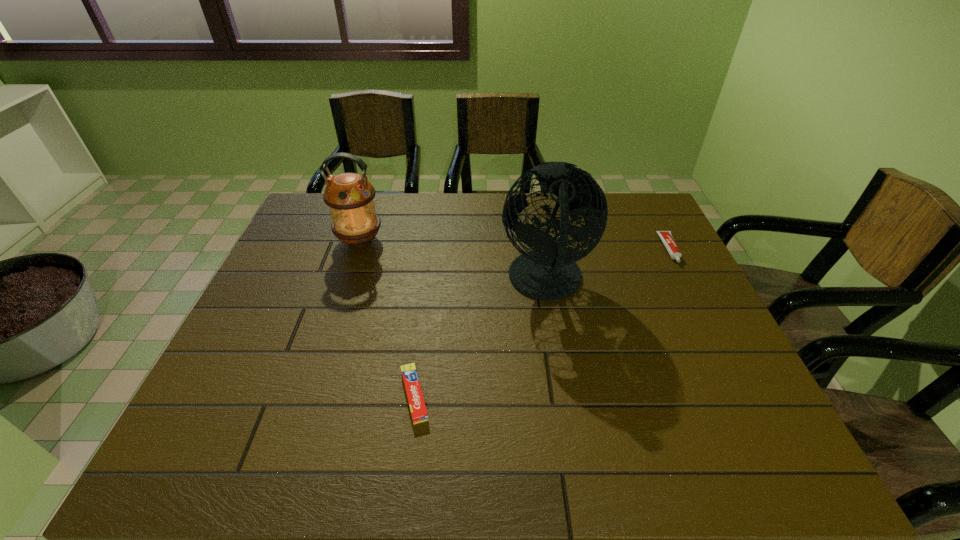
What are the coordinates of `free space between the tallest object and the oil lamp` in the screenshot? It's located at (453, 261).

Locate an element on the screen. empty space that is in between the shorter toothpaste and the third shortest object is located at coordinates (387, 318).

Locate an element on the screen. free space between the right toothpaste and the nearest object is located at coordinates (542, 322).

Locate an element on the screen. This screenshot has height=540, width=960. object that is the nearest to the tallest object is located at coordinates (419, 414).

Locate an element on the screen. Image resolution: width=960 pixels, height=540 pixels. object that can be found as the closest to the leftmost object is located at coordinates (549, 272).

Image resolution: width=960 pixels, height=540 pixels. Find the location of `free space in the image that satisfies the following two spatial constraints: 1. at the nozzle of the taller toothpaste; 2. on the front-facing side of the tallest object`. free space in the image that satisfies the following two spatial constraints: 1. at the nozzle of the taller toothpaste; 2. on the front-facing side of the tallest object is located at coordinates (686, 282).

Locate an element on the screen. This screenshot has width=960, height=540. free space in the image that satisfies the following two spatial constraints: 1. on the front-facing side of the globe; 2. on the front side of the left toothpaste is located at coordinates (564, 395).